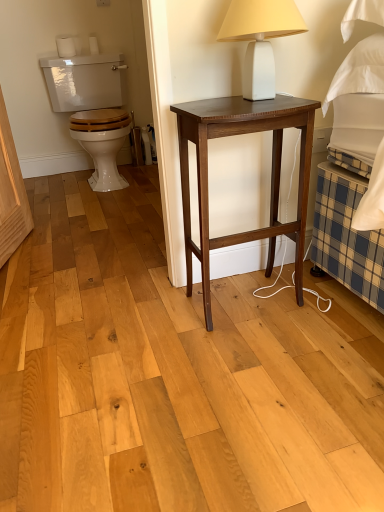
Find the location of a particular element. The width and height of the screenshot is (384, 512). vacant area located to the right-hand side of dark wood nightstand at center is located at coordinates (337, 311).